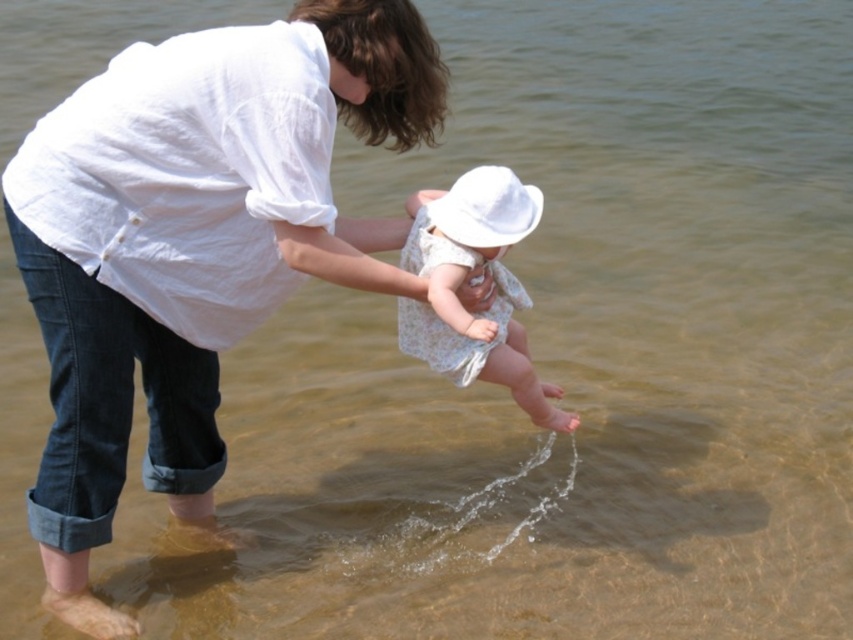
Question: Is white lace dress at center above white matte hat at center?

Choices:
 (A) yes
 (B) no

Answer: (B)

Question: Is white lace dress at center to the right of white matte hat at center from the viewer's perspective?

Choices:
 (A) yes
 (B) no

Answer: (A)

Question: Can you confirm if white lace dress at center is positioned below white matte hat at center?

Choices:
 (A) no
 (B) yes

Answer: (B)